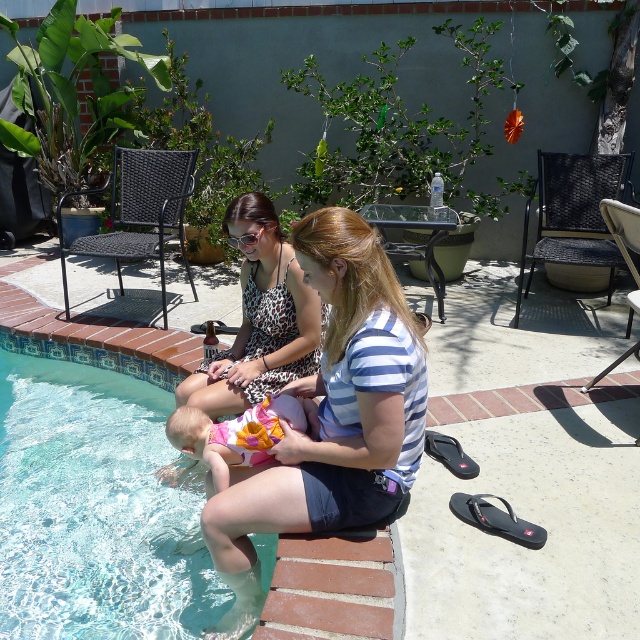
Question: Can you confirm if clear glass water at lower left is bigger than floral swimsuit at poolside?

Choices:
 (A) yes
 (B) no

Answer: (A)

Question: Can you confirm if clear glass water at lower left is positioned to the left of leopard print dress at center?

Choices:
 (A) yes
 (B) no

Answer: (A)

Question: Which object is positioned closest to the striped cotton shirt at center?

Choices:
 (A) leopard print dress at center
 (B) clear glass water at lower left

Answer: (A)

Question: Does striped cotton shirt at center have a larger size compared to floral swimsuit at poolside?

Choices:
 (A) no
 (B) yes

Answer: (B)

Question: Based on their relative distances, which object is farther from the leopard print dress at center?

Choices:
 (A) striped cotton shirt at center
 (B) clear glass water at lower left
 (C) floral swimsuit at poolside

Answer: (B)

Question: Which object appears farthest from the camera in this image?

Choices:
 (A) floral swimsuit at poolside
 (B) clear glass water at lower left
 (C) striped cotton shirt at center

Answer: (B)